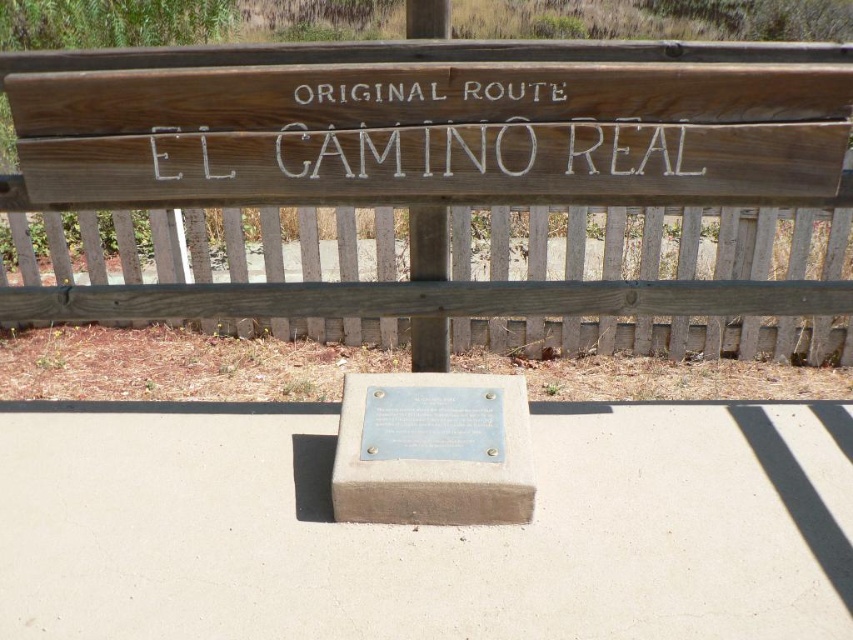
Question: Is wooden sign at center thinner than gray concrete plaque at center?

Choices:
 (A) yes
 (B) no

Answer: (B)

Question: Is wooden sign at center positioned at the back of gray concrete plaque at center?

Choices:
 (A) no
 (B) yes

Answer: (B)

Question: Which object is closer to the camera taking this photo?

Choices:
 (A) gray concrete plaque at center
 (B) wooden sign at center

Answer: (A)

Question: Can you confirm if wooden sign at center is thinner than gray concrete plaque at center?

Choices:
 (A) yes
 (B) no

Answer: (B)

Question: Which of the following is the farthest from the observer?

Choices:
 (A) gray concrete plaque at center
 (B) wooden sign at center

Answer: (B)

Question: Which of the following is the farthest from the observer?

Choices:
 (A) (523, 120)
 (B) (369, 486)

Answer: (A)